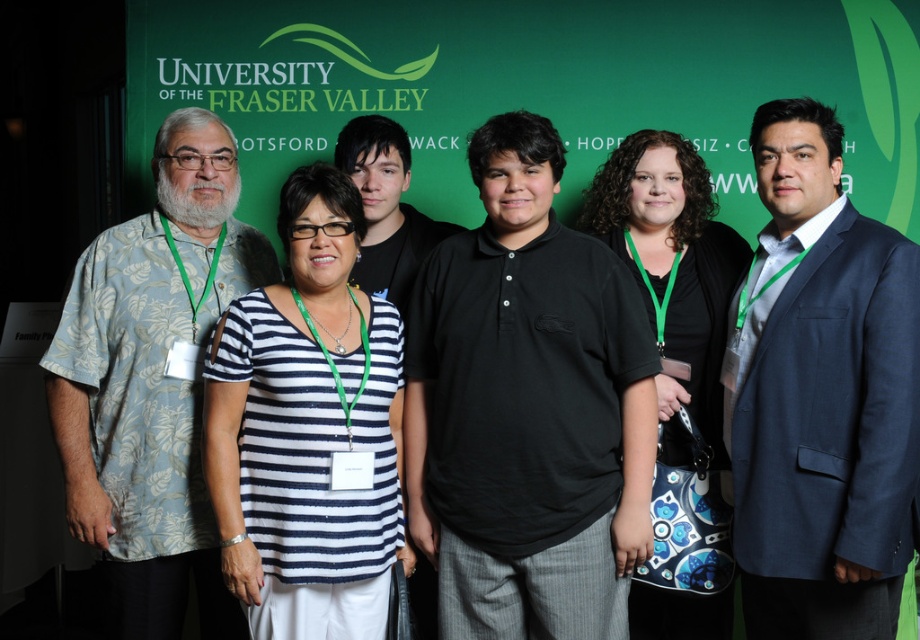
Is black cotton polo shirt at center closer to the viewer compared to navy blue suit at center?

That is False.

Who is more distant from viewer, (513, 378) or (880, 337)?

The point (513, 378) is more distant.

Between point (447, 477) and point (815, 108), which one is positioned in front?

Positioned in front is point (447, 477).

The width and height of the screenshot is (920, 640). What are the coordinates of `black cotton polo shirt at center` in the screenshot? It's located at (527, 408).

Between navy blue suit at center and light blue floral shirt at left, which one is positioned lower?

light blue floral shirt at left

Between navy blue suit at center and light blue floral shirt at left, which one appears on the right side from the viewer's perspective?

Positioned to the right is navy blue suit at center.

The image size is (920, 640). I want to click on navy blue suit at center, so click(820, 396).

At what (x,y) coordinates should I click in order to perform the action: click on navy blue suit at center. Please return your answer as a coordinate pair (x, y). Looking at the image, I should click on click(x=820, y=396).

Can you confirm if black cotton polo shirt at center is positioned above light blue floral shirt at left?

Correct, black cotton polo shirt at center is located above light blue floral shirt at left.

From the picture: Between black cotton polo shirt at center and light blue floral shirt at left, which one has more height?

With more height is light blue floral shirt at left.

Is point (627, 307) more distant than point (224, 180)?

No.

Where is `black cotton polo shirt at center`? The image size is (920, 640). black cotton polo shirt at center is located at coordinates (527, 408).